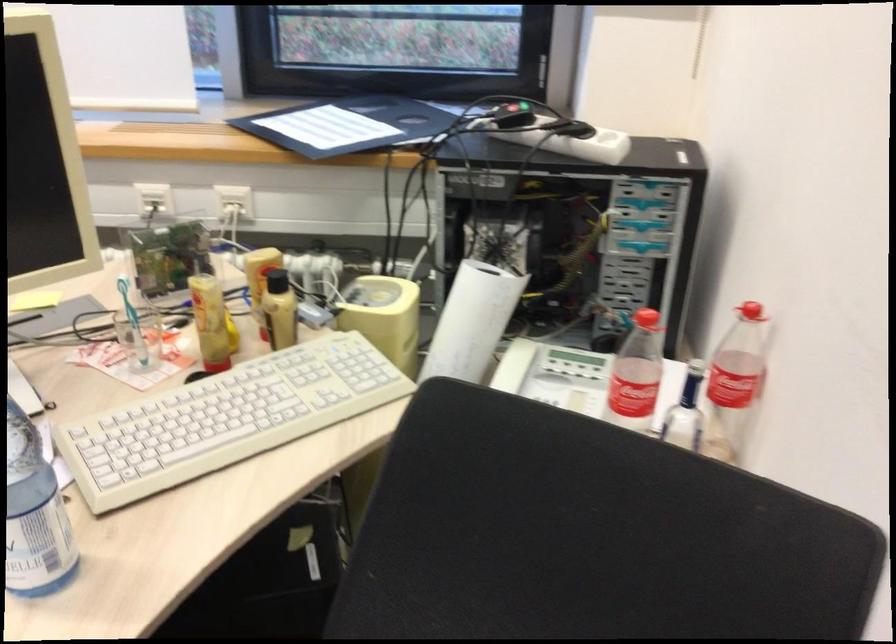
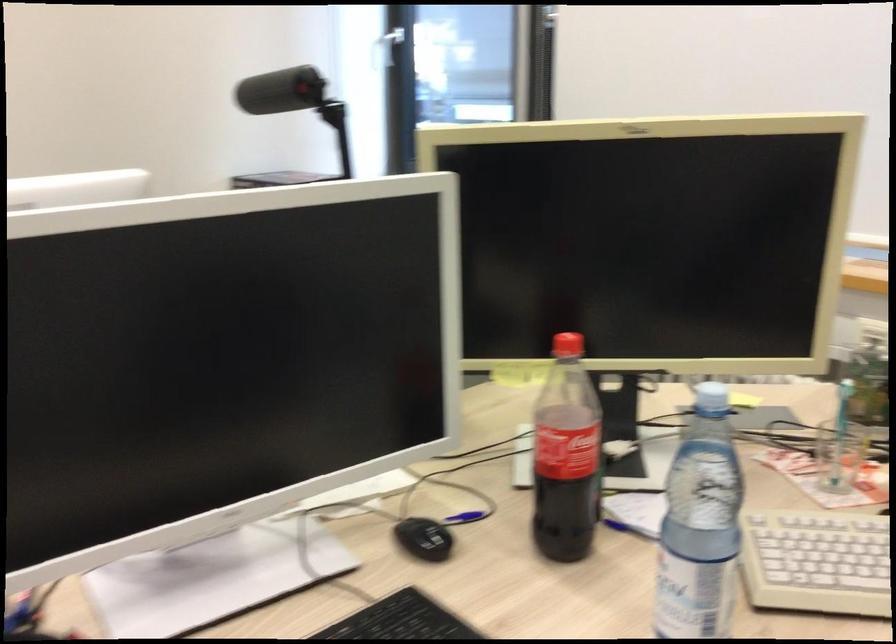
The point at (145, 343) is marked in the first image. Where is the corresponding point in the second image?

(839, 456)